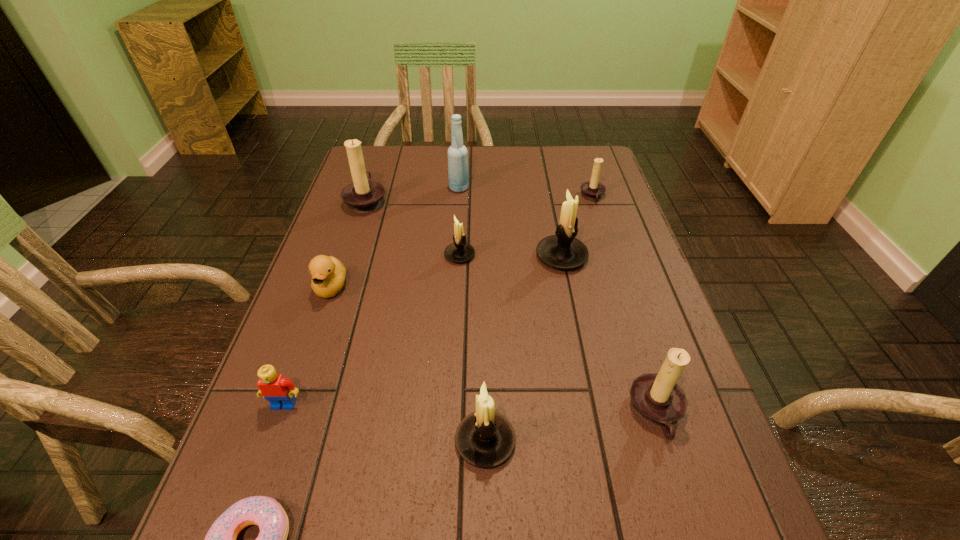
At what (x,y) coordinates should I click in order to perform the action: click on bottle. Please return your answer as a coordinate pair (x, y). The image size is (960, 540). Looking at the image, I should click on (458, 173).

What are the coordinates of `the biggest brown candle holder` in the screenshot? It's located at (364, 195).

In order to click on the leftmost brown candle holder in this screenshot , I will do `click(364, 195)`.

Where is `the biggest white candle holder`? This screenshot has height=540, width=960. the biggest white candle holder is located at coordinates (562, 251).

Where is `the rightmost white candle holder`? This screenshot has height=540, width=960. the rightmost white candle holder is located at coordinates (562, 251).

You are a GUI agent. You are given a task and a screenshot of the screen. Output one action in this format:
    pyautogui.click(x=<x>, y=<y>)
    Task: Click on the second smallest brown candle holder
    The image size is (960, 540).
    Given the screenshot: What is the action you would take?
    pos(657,398)

Locate an element on the screen. the nearest white candle holder is located at coordinates (485, 439).

Where is `the smallest brown candle holder`? Image resolution: width=960 pixels, height=540 pixels. the smallest brown candle holder is located at coordinates (593, 190).

The image size is (960, 540). Find the location of `the smallest white candle holder`. the smallest white candle holder is located at coordinates (459, 251).

You are a GUI agent. You are given a task and a screenshot of the screen. Output one action in this format:
    pyautogui.click(x=<x>, y=<y>)
    Task: Click on the Lego
    The image size is (960, 540).
    Given the screenshot: What is the action you would take?
    pyautogui.click(x=276, y=389)